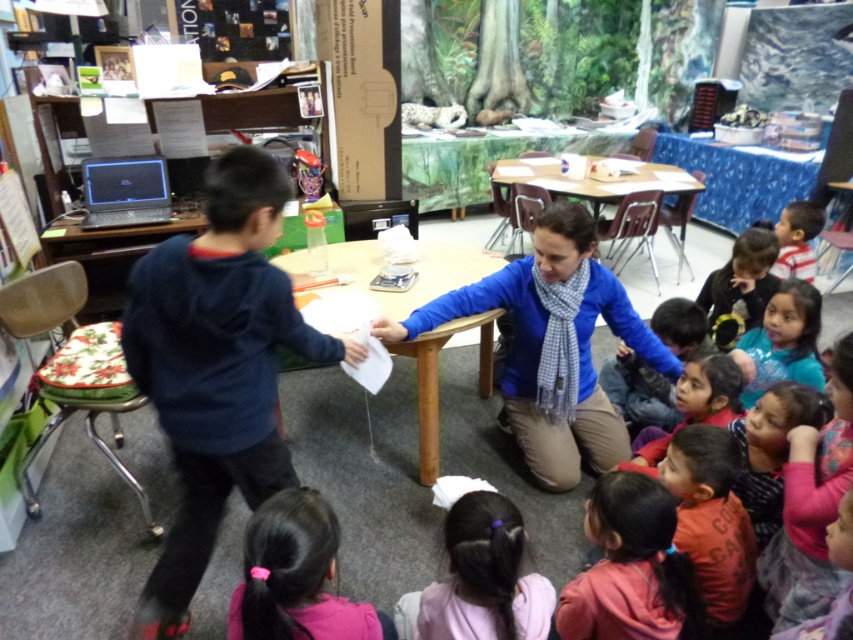
Is point (390, 625) positioned behind point (735, 289)?

No, it is not.

Between pink fabric ponytail at lower center and dark blue sweater at lower right, which one is positioned higher?

Positioned higher is dark blue sweater at lower right.

What do you see at coordinates (296, 577) in the screenshot? I see `pink fabric ponytail at lower center` at bounding box center [296, 577].

At what (x,y) coordinates should I click in order to perform the action: click on pink fabric ponytail at lower center. Please return your answer as a coordinate pair (x, y). Image resolution: width=853 pixels, height=640 pixels. Looking at the image, I should click on (296, 577).

Which is below, pink fabric hair tie at lower center or blue fabric shirt at lower right?

pink fabric hair tie at lower center is below.

Based on the photo, is pink fabric hair tie at lower center closer to camera compared to blue fabric shirt at lower right?

Yes, it is in front of blue fabric shirt at lower right.

Between point (670, 614) and point (817, 323), which one is positioned in front?

Point (670, 614) is in front.

The image size is (853, 640). I want to click on pink fabric hair tie at lower center, so click(x=631, y=568).

Can you confirm if pink fabric hair tie at lower center is shorter than dark blue sweater at lower right?

Indeed, pink fabric hair tie at lower center has a lesser height compared to dark blue sweater at lower right.

Find the location of a particular element. This screenshot has width=853, height=640. pink fabric hair tie at lower center is located at coordinates (631, 568).

This screenshot has height=640, width=853. I want to click on pink fabric hair tie at lower center, so click(x=631, y=568).